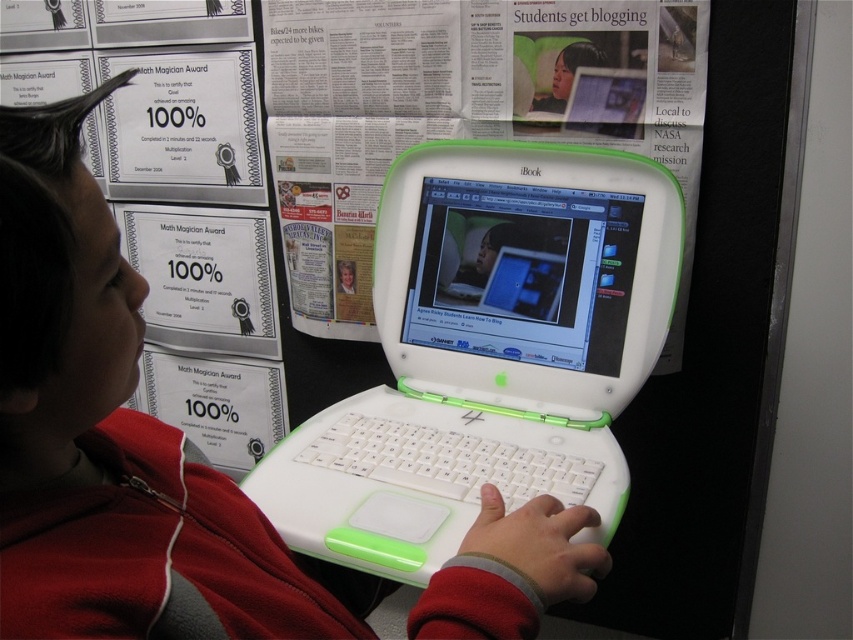
Question: Which is farther from the white plastic laptop at upper center?

Choices:
 (A) white plastic laptop at center
 (B) matte white jacket at center

Answer: (B)

Question: Which object is farther from the camera taking this photo?

Choices:
 (A) white plastic laptop at center
 (B) matte white jacket at center

Answer: (A)

Question: Which object is positioned closest to the white plastic laptop at center?

Choices:
 (A) white plastic laptop at upper center
 (B) matte white jacket at center

Answer: (B)

Question: Is the position of white plastic laptop at center more distant than that of matte white jacket at center?

Choices:
 (A) no
 (B) yes

Answer: (B)

Question: Is matte white jacket at center to the left of white plastic laptop at upper center from the viewer's perspective?

Choices:
 (A) yes
 (B) no

Answer: (A)

Question: Does white plastic laptop at center have a lesser width compared to white plastic laptop at upper center?

Choices:
 (A) yes
 (B) no

Answer: (A)